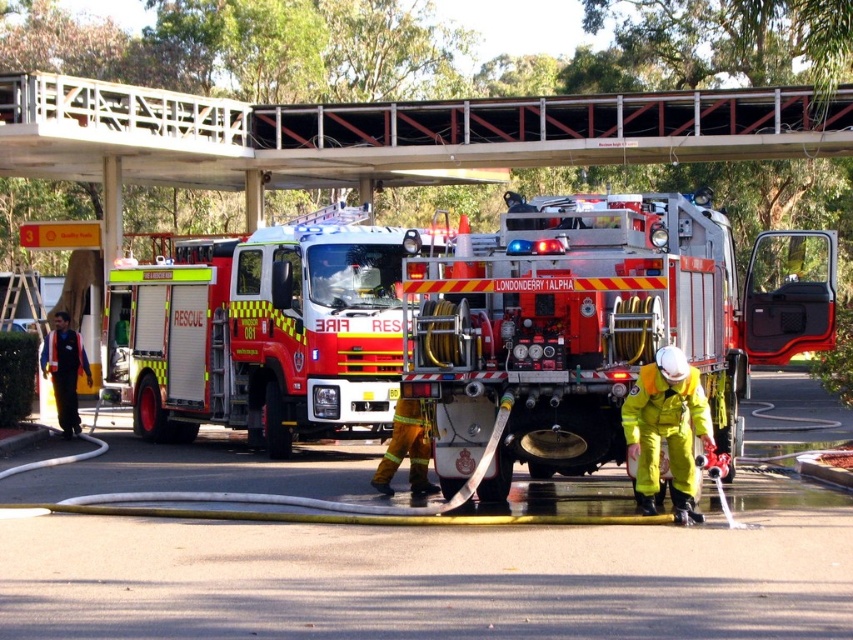
Question: Does red reflective fire truck at center appear under yellow reflective uniform at lower right?

Choices:
 (A) yes
 (B) no

Answer: (B)

Question: Which point is farther from the camera taking this photo?

Choices:
 (A) (730, 412)
 (B) (688, 467)
 (C) (415, 116)
 (D) (170, 321)

Answer: (C)

Question: Which is farther from the red reflective fire truck at center?

Choices:
 (A) yellow reflective uniform at lower right
 (B) reflective orange uniform at left
 (C) red/yellow reflective rescue vehicle at center

Answer: (B)

Question: Which point is closer to the camera?

Choices:
 (A) (675, 312)
 (B) (160, 248)
 (C) (643, 513)
 (D) (53, 362)

Answer: (A)

Question: Can you confirm if red reflective fire truck at center is thinner than red/yellow reflective rescue vehicle at center?

Choices:
 (A) no
 (B) yes

Answer: (A)

Question: Does red reflective fire truck at center have a greater width compared to red/yellow reflective rescue vehicle at center?

Choices:
 (A) yes
 (B) no

Answer: (A)